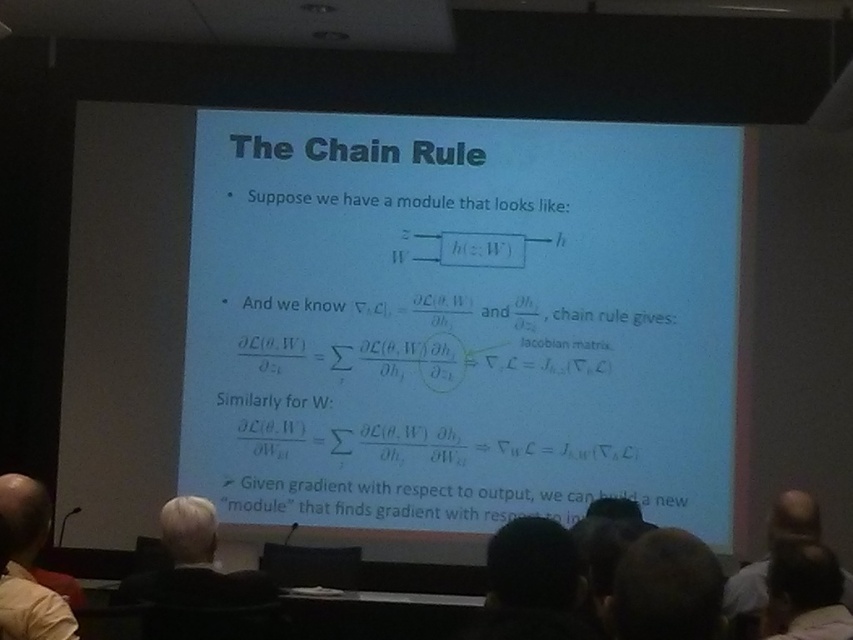
You are a student sitting in the front row of the lecture hall and notice the light beige shirt at lower left and the gray hair at lower right. Which of these two features is located to the left side of the other?

The light beige shirt at lower left is positioned on the left side of gray hair at lower right.

You are standing in the front of the room facing the screen. There is a light beige shirt at lower left. Where is the light beige shirt located relative to the screen?

The light beige shirt at lower left is located at the lower left corner of the screen, positioned at coordinates approximately 0.886 on the x and 0.034 on the y axis.

You are observing a slide about the chain rule in calculus. The slide has two hair elements for visual emphasis. Which hair element, the white hair at upper left or the brown hair at upper right, is bigger in size?

The white hair at upper left is larger in size compared to the brown hair at upper right.